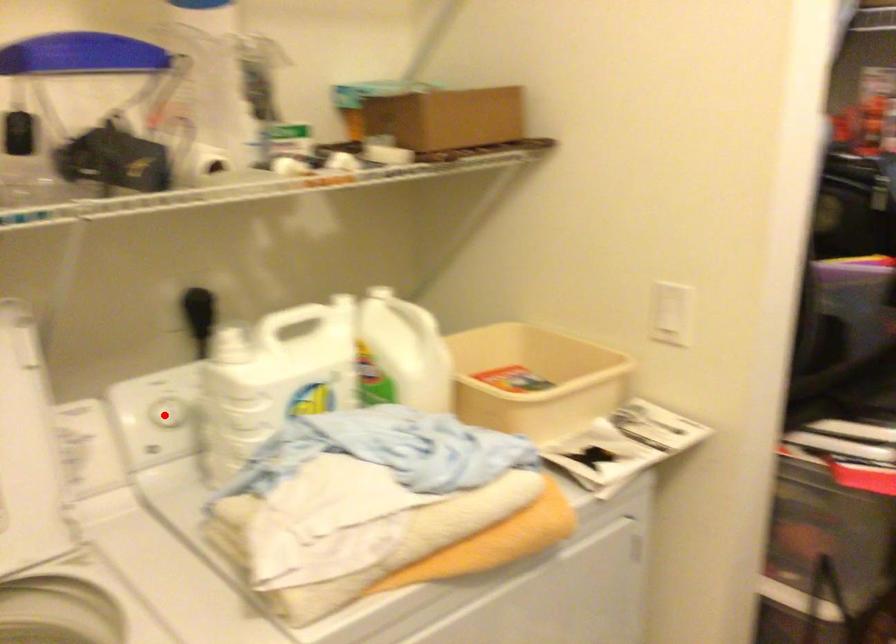
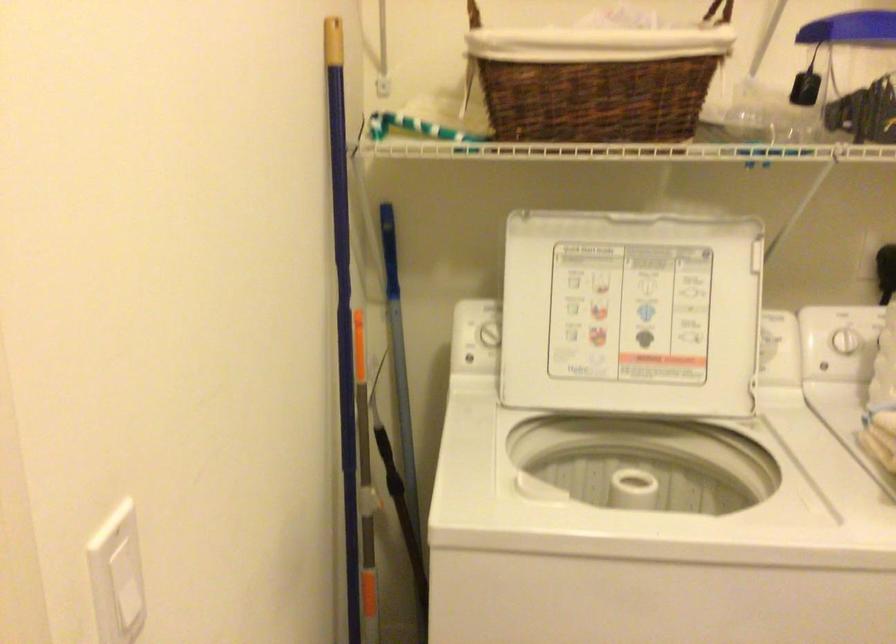
Where in the second image is the point corresponding to the highlighted location from the first image?

(845, 341)